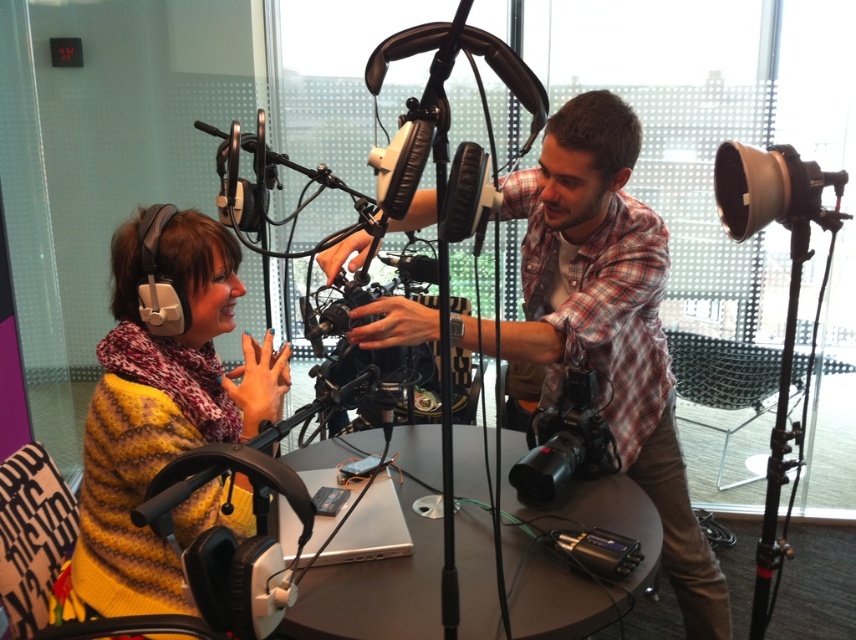
You are a guest entering the studio and need to choose between the plaid shirt at center and the knitted yellow sweater at left to wear for the recording. Based on their sizes, which one would you pick and why?

The plaid shirt at center is larger in size than the knitted yellow sweater at left, so you should choose the plaid shirt at center because it offers a better fit for comfort during the recording session.

You are an audio engineer in the studio and need to adjust the microphone closest to the knitted yellow sweater at left. Which direction should you move the microphone to align it with the sweater?

The knitted yellow sweater at left is located at point (161, 410). To align the microphone with the sweater, move it towards the coordinates where the sweater is positioned.